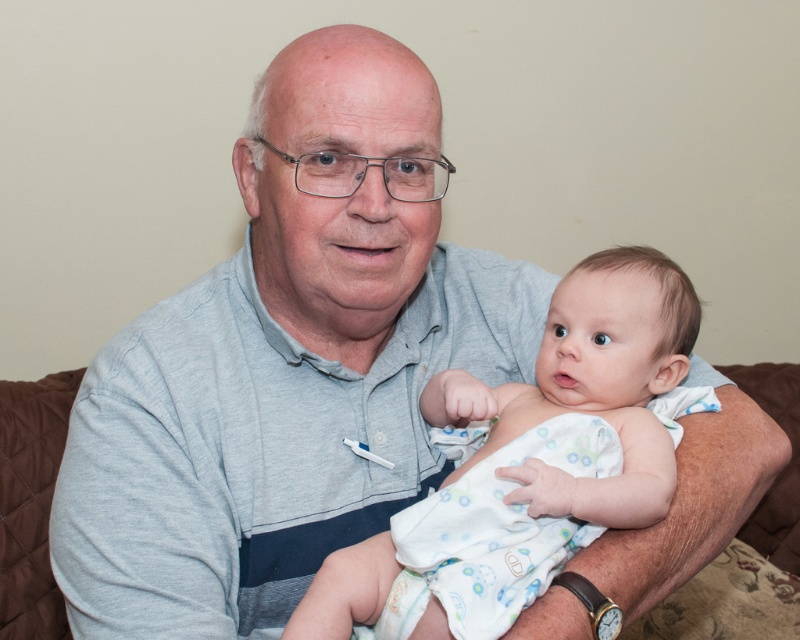
Does white cotton baby at center appear under brown quilted couch at center?

Incorrect, white cotton baby at center is not positioned below brown quilted couch at center.

Between white cotton baby at center and brown quilted couch at center, which one appears on the left side from the viewer's perspective?

Positioned to the left is brown quilted couch at center.

Is point (668, 268) farther from viewer compared to point (28, 390)?

No, (668, 268) is in front of (28, 390).

Identify the location of white cotton baby at center. (532, 458).